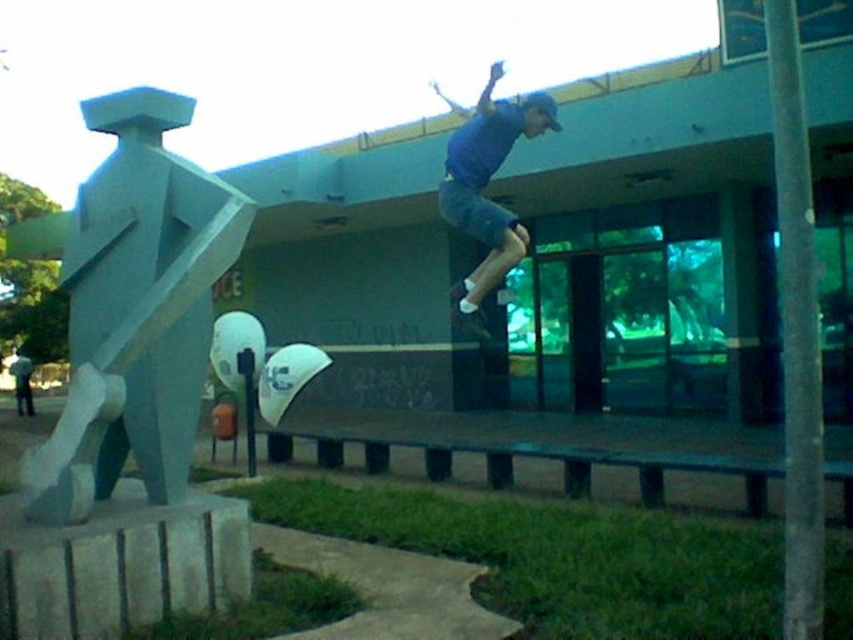
Which is above, blue matte skateboard at upper center or white rubber skateboard at center?

Positioned higher is blue matte skateboard at upper center.

Is point (461, 182) farther from viewer compared to point (459, 308)?

No, it is in front of (459, 308).

At what (x,y) coordinates should I click in order to perform the action: click on blue matte skateboard at upper center. Please return your answer as a coordinate pair (x, y). Looking at the image, I should click on (486, 182).

Find the location of `blue matte skateboard at upper center`. blue matte skateboard at upper center is located at coordinates (486, 182).

Is light blue stone statue at left wider than white rubber skateboard at center?

Correct, the width of light blue stone statue at left exceeds that of white rubber skateboard at center.

Which is behind, point (206, 209) or point (463, 308)?

Point (463, 308)

What do you see at coordinates (132, 307) in the screenshot? I see `light blue stone statue at left` at bounding box center [132, 307].

Image resolution: width=853 pixels, height=640 pixels. I want to click on light blue stone statue at left, so click(x=132, y=307).

Between light blue stone statue at left and blue matte skateboard at upper center, which one appears on the right side from the viewer's perspective?

blue matte skateboard at upper center

At what (x,y) coordinates should I click in order to perform the action: click on light blue stone statue at left. Please return your answer as a coordinate pair (x, y). The image size is (853, 640). Looking at the image, I should click on (132, 307).

Where is `light blue stone statue at left`? The width and height of the screenshot is (853, 640). light blue stone statue at left is located at coordinates (132, 307).